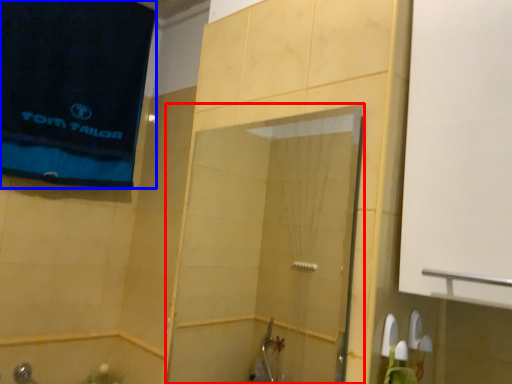
Question: Which point is closer to the camera, screen door (highlighted by a red box) or beach towel (highlighted by a blue box)?

Choices:
 (A) screen door
 (B) beach towel

Answer: (A)